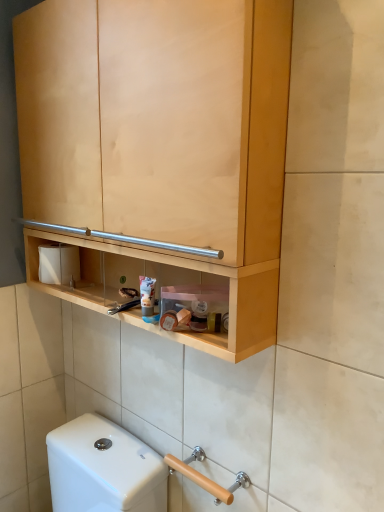
Question: Is white matte toilet paper at left smaller than matte plastic tube at center?

Choices:
 (A) no
 (B) yes

Answer: (A)

Question: Is white matte toilet paper at left next to matte plastic tube at center and touching it?

Choices:
 (A) no
 (B) yes

Answer: (A)

Question: Is white matte toilet paper at left to the right of matte plastic tube at center from the viewer's perspective?

Choices:
 (A) yes
 (B) no

Answer: (B)

Question: From the image's perspective, is white matte toilet paper at left above matte plastic tube at center?

Choices:
 (A) no
 (B) yes

Answer: (B)

Question: Is white matte toilet paper at left looking in the opposite direction of matte plastic tube at center?

Choices:
 (A) yes
 (B) no

Answer: (B)

Question: In terms of width, does beige wood grab bar at lower right look wider or thinner when compared to white matte toilet paper at left?

Choices:
 (A) wide
 (B) thin

Answer: (B)

Question: Is beige wood grab bar at lower right taller or shorter than white matte toilet paper at left?

Choices:
 (A) short
 (B) tall

Answer: (A)

Question: Choose the correct answer: Is beige wood grab bar at lower right inside white matte toilet paper at left or outside it?

Choices:
 (A) inside
 (B) outside

Answer: (B)

Question: From the image's perspective, is beige wood grab bar at lower right located above or below white matte toilet paper at left?

Choices:
 (A) below
 (B) above

Answer: (A)

Question: Considering the positions of matte plastic tube at center and white matte toilet paper at left in the image, is matte plastic tube at center wider or thinner than white matte toilet paper at left?

Choices:
 (A) wide
 (B) thin

Answer: (B)

Question: From a real-world perspective, relative to white matte toilet paper at left, is matte plastic tube at center vertically above or below?

Choices:
 (A) below
 (B) above

Answer: (A)

Question: Is matte plastic tube at center bigger or smaller than white matte toilet paper at left?

Choices:
 (A) big
 (B) small

Answer: (B)

Question: From the image's perspective, relative to white matte toilet paper at left, is matte plastic tube at center above or below?

Choices:
 (A) above
 (B) below

Answer: (B)

Question: From the image's perspective, is white matte toilet paper at left above or below beige wood grab bar at lower right?

Choices:
 (A) above
 (B) below

Answer: (A)

Question: Is point (72, 256) closer or farther from the camera than point (211, 484)?

Choices:
 (A) closer
 (B) farther

Answer: (B)